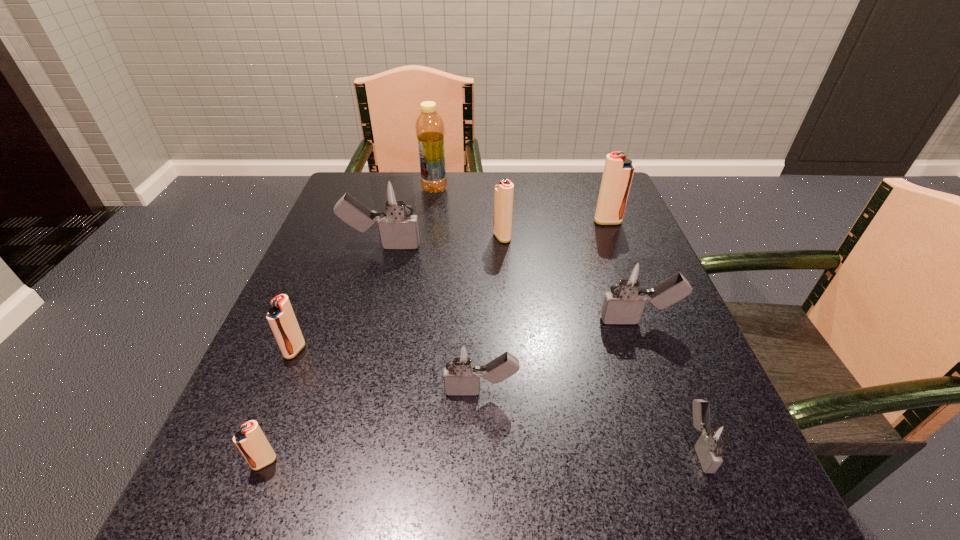
Find the location of a particular element. This screenshot has width=960, height=540. the third closest gray igniter to the smallest gray igniter is located at coordinates (394, 195).

I want to click on gray igniter that stands as the second closest to the second biggest red igniter, so click(x=630, y=281).

Find the location of `vacant region that satisfies the following two spatial constraints: 1. on the back side of the second smallest red igniter; 2. on the left side of the second biggest red igniter`. vacant region that satisfies the following two spatial constraints: 1. on the back side of the second smallest red igniter; 2. on the left side of the second biggest red igniter is located at coordinates (341, 237).

I want to click on vacant point that satisfies the following two spatial constraints: 1. on the back side of the nearest red igniter; 2. on the left side of the tallest object, so click(x=368, y=189).

Image resolution: width=960 pixels, height=540 pixels. I want to click on free space that satisfies the following two spatial constraints: 1. on the back side of the farthest igniter; 2. on the left side of the fifth farthest igniter, so click(347, 222).